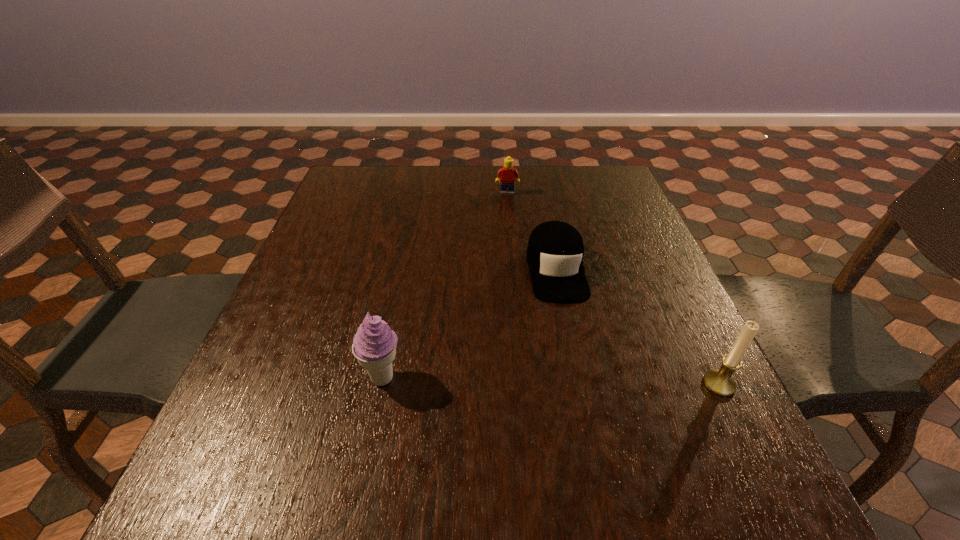
Locate an element on the screen. This screenshot has height=540, width=960. icecream is located at coordinates [374, 345].

Where is `candle holder`? The width and height of the screenshot is (960, 540). candle holder is located at coordinates (720, 382).

Locate an element on the screen. This screenshot has width=960, height=540. the farthest object is located at coordinates (507, 174).

You are a GUI agent. You are given a task and a screenshot of the screen. Output one action in this format:
    pyautogui.click(x=<x>, y=<y>)
    Task: Click on the third tallest object
    This screenshot has width=960, height=540.
    Given the screenshot: What is the action you would take?
    point(507,174)

Locate an element on the screen. the third nearest object is located at coordinates (555, 251).

The image size is (960, 540). I want to click on cap, so click(x=555, y=251).

This screenshot has width=960, height=540. Identify the location of vacant region located 0.060m on the right of the icecream. (435, 378).

This screenshot has width=960, height=540. In order to click on free space located 0.380m on the left of the rightmost object in this screenshot , I will do pyautogui.click(x=498, y=384).

You are a GUI agent. You are given a task and a screenshot of the screen. Output one action in this format:
    pyautogui.click(x=<x>, y=<y>)
    Task: Click on the free space located on the front-facing side of the third tallest object
    The image size is (960, 540).
    Given the screenshot: What is the action you would take?
    pyautogui.click(x=505, y=237)

Identify the location of vacant space located 0.190m on the front-facing side of the third tallest object. (506, 232).